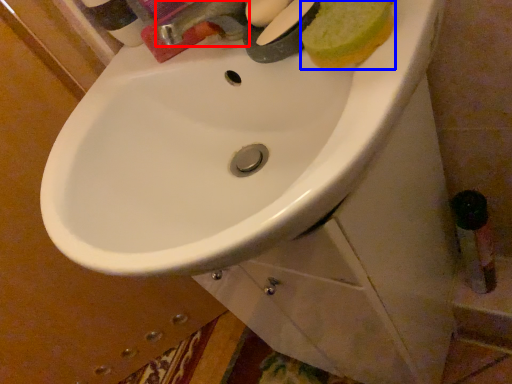
Question: Among these objects, which one is nearest to the camera, tap (highlighted by a red box) or food (highlighted by a blue box)?

Choices:
 (A) tap
 (B) food

Answer: (B)